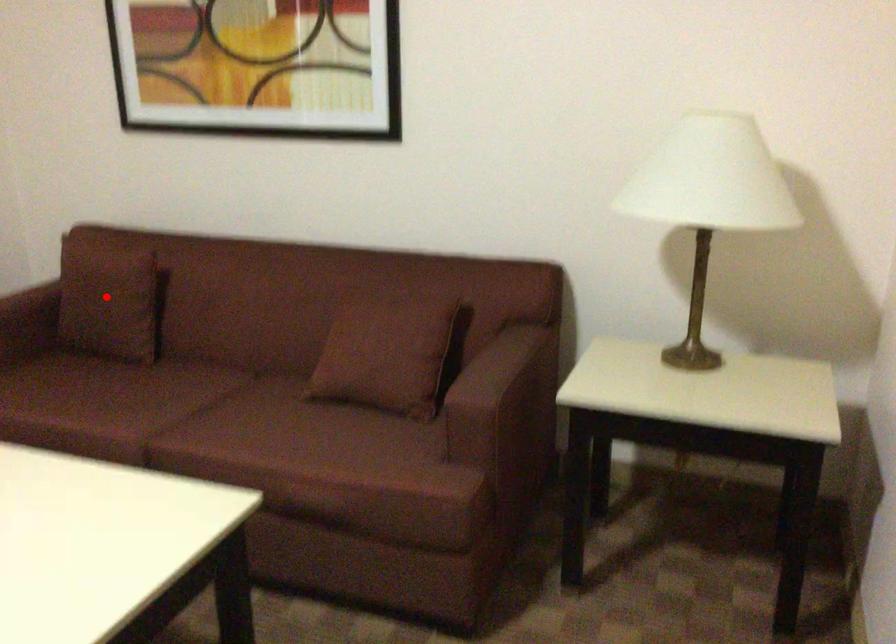
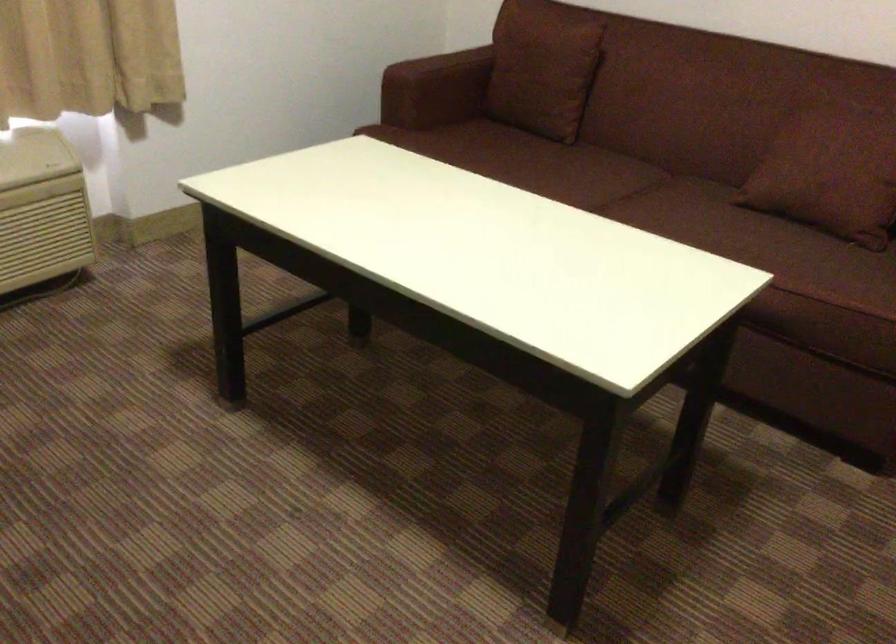
In the second image, find the point that corresponds to the highlighted location in the first image.

(543, 69)